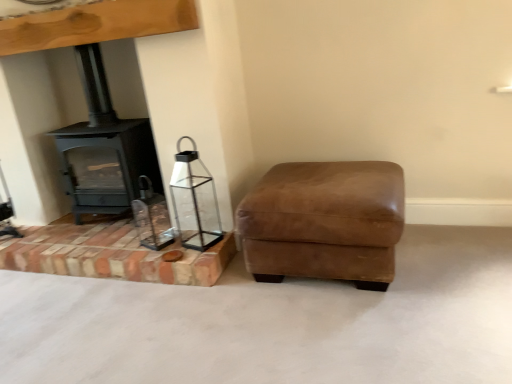
Find the location of a particular element. free region under matte black wood burning stove at left (from a real-world perspective) is located at coordinates click(x=103, y=224).